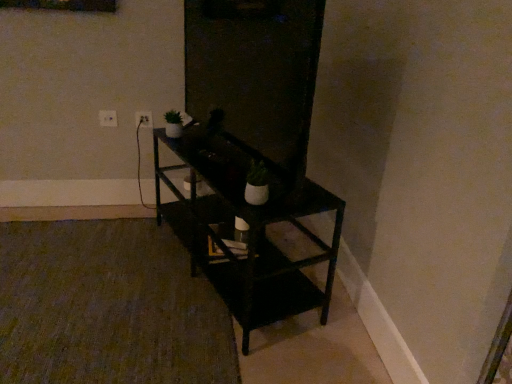
Question: Considering the positions of white plastic electric outlet at upper left, positioned as the 1th electric outlet in right-to-left order, and green matte houseplant at upper left, marked as the first houseplant in a left-to-right arrangement, in the image, is white plastic electric outlet at upper left, positioned as the 1th electric outlet in right-to-left order, wider or thinner than green matte houseplant at upper left, marked as the first houseplant in a left-to-right arrangement,?

Choices:
 (A) wide
 (B) thin

Answer: (B)

Question: Is white plastic electric outlet at upper left, which appears as the second electric outlet when viewed from the left, taller or shorter than green matte houseplant at upper left, positioned as the 2th houseplant in front-to-back order?

Choices:
 (A) tall
 (B) short

Answer: (B)

Question: Which object is the farthest from the white plastic electric outlet at upper left, the second electric outlet viewed from the right?

Choices:
 (A) white plastic electric outlet at upper left, which appears as the second electric outlet when viewed from the left
 (B) green matte houseplant at upper left, positioned as the 2th houseplant in front-to-back order
 (C) black matte shelf at center
 (D) transparent glass door at center
 (E) white matte pot at center, the 2th houseplant in the back-to-front sequence

Answer: (E)

Question: Which of these objects is positioned farthest from the black matte shelf at center?

Choices:
 (A) white plastic electric outlet at upper left, which is the 1th electric outlet from left to right
 (B) transparent glass door at center
 (C) white matte pot at center, arranged as the first houseplant when viewed from the front
 (D) white plastic electric outlet at upper left, which appears as the second electric outlet when viewed from the left
 (E) green matte houseplant at upper left, acting as the 1th houseplant starting from the back

Answer: (A)